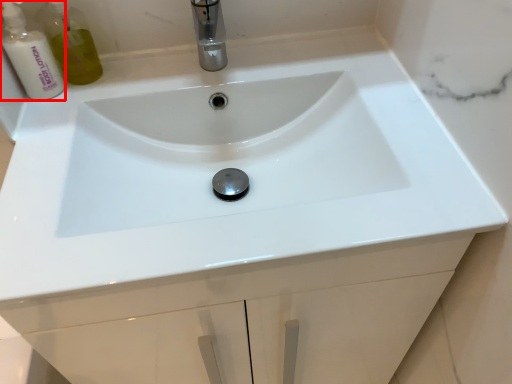
Question: From the image's perspective, where is cleaning product (annotated by the red box) located in relation to tap in the image?

Choices:
 (A) above
 (B) below

Answer: (B)